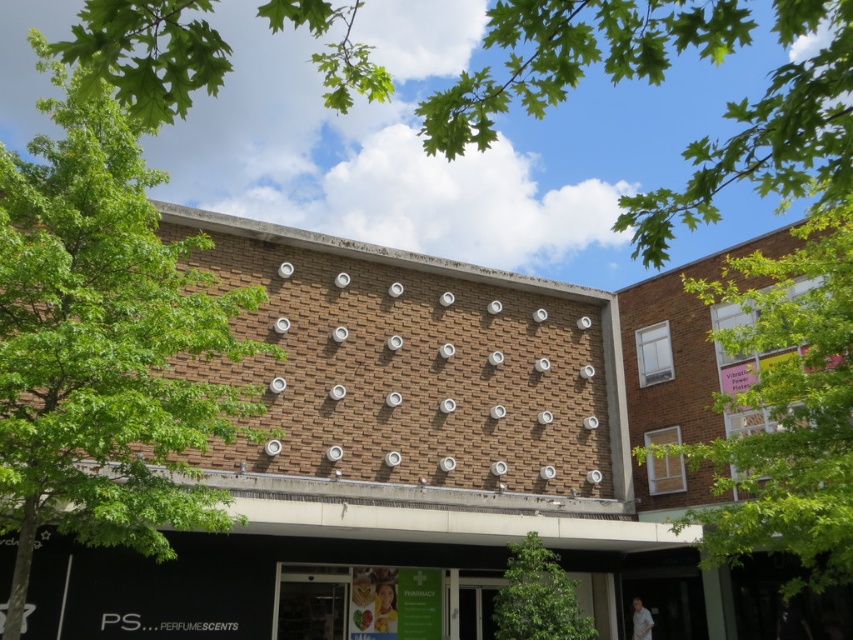
Between green leafy tree at upper center and green leafy tree at upper right, which one is positioned lower?

Positioned lower is green leafy tree at upper right.

Does green leafy tree at upper center appear on the right side of green leafy tree at upper right?

In fact, green leafy tree at upper center is to the left of green leafy tree at upper right.

Is point (527, 109) closer to camera compared to point (753, 538)?

Yes, point (527, 109) is closer to viewer.

At what (x,y) coordinates should I click in order to perform the action: click on green leafy tree at upper center. Please return your answer as a coordinate pair (x, y). The height and width of the screenshot is (640, 853). Looking at the image, I should click on (573, 56).

Measure the distance from green leafy tree at upper left to green leafy tree at lower center.

19.63 feet

Between point (126, 312) and point (581, 630), which one is positioned in front?

Point (126, 312) is more forward.

Which is behind, point (136, 294) or point (497, 625)?

Positioned behind is point (497, 625).

The image size is (853, 640). Find the location of `green leafy tree at upper left`. green leafy tree at upper left is located at coordinates (103, 342).

Does green leafy tree at upper left come in front of green leafy tree at upper center?

That is False.

Can you confirm if green leafy tree at upper left is taller than green leafy tree at upper center?

No, green leafy tree at upper left is not taller than green leafy tree at upper center.

Is point (33, 484) more distant than point (695, 140)?

No, (33, 484) is in front of (695, 140).

Find the location of a particular element. The height and width of the screenshot is (640, 853). green leafy tree at upper left is located at coordinates (103, 342).